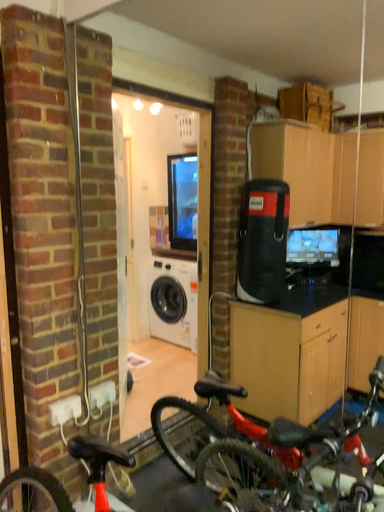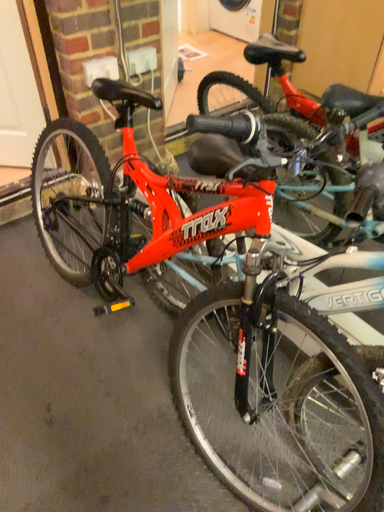
Question: Which way did the camera rotate in the video?

Choices:
 (A) rotated left
 (B) rotated right

Answer: (A)